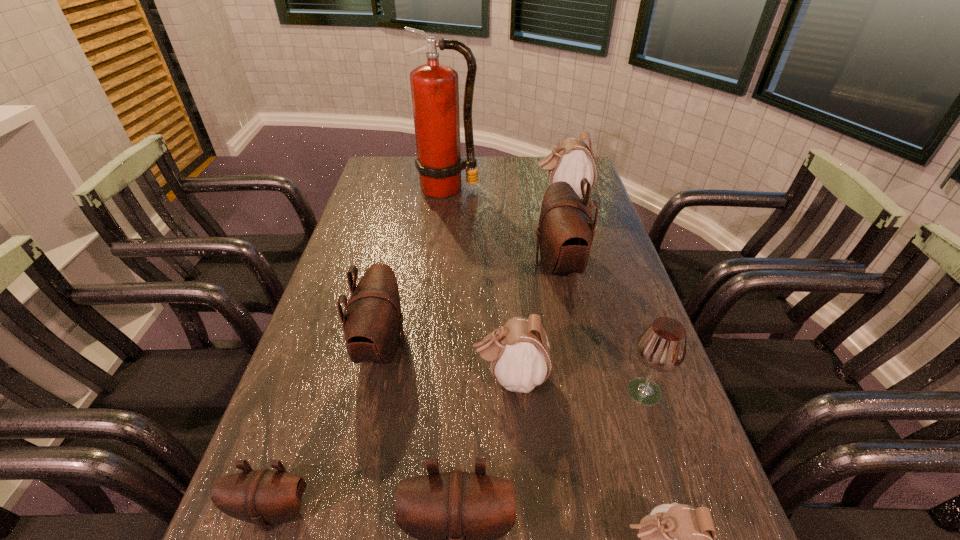
Where is `red fire extinguisher`? This screenshot has width=960, height=540. red fire extinguisher is located at coordinates pyautogui.click(x=434, y=86).

The image size is (960, 540). I want to click on the tallest object, so click(x=434, y=86).

Locate an element on the screen. The height and width of the screenshot is (540, 960). the seventh nearest object is located at coordinates (566, 229).

Find the location of `the rightmost brown pouch`. the rightmost brown pouch is located at coordinates tap(566, 229).

Locate an element on the screen. This screenshot has height=540, width=960. the biggest white pouch is located at coordinates (571, 160).

Locate an element on the screen. the farthest white pouch is located at coordinates (571, 160).

Where is `the third nearest brown pouch`? The width and height of the screenshot is (960, 540). the third nearest brown pouch is located at coordinates pos(372,320).

Identify the location of wineglass. Image resolution: width=960 pixels, height=540 pixels. (661, 347).

Locate an element on the screen. This screenshot has height=540, width=960. the second biggest white pouch is located at coordinates (519, 352).

Locate an element on the screen. The image size is (960, 540). the leftmost white pouch is located at coordinates (519, 352).